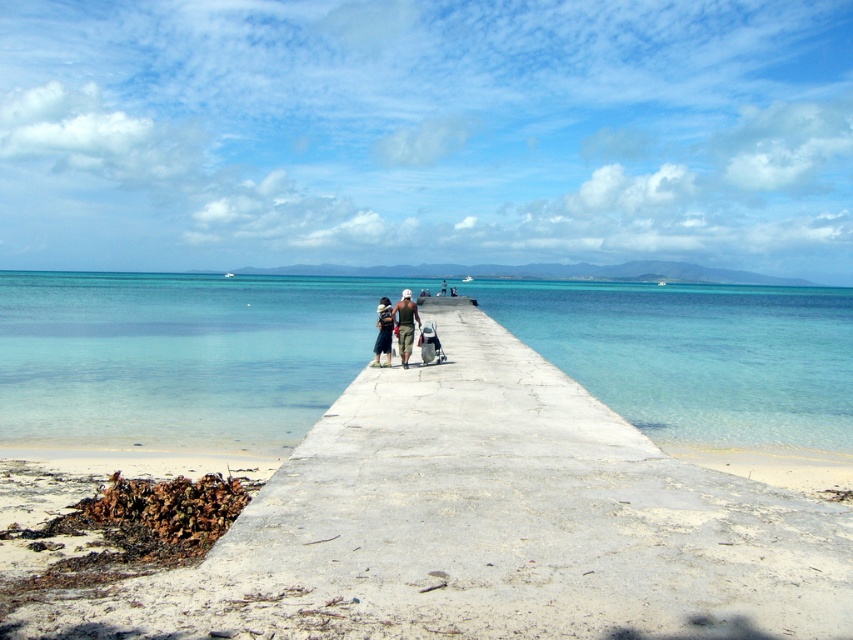
Is clear blue water at center bigger than matte khaki shorts at center?

Indeed, clear blue water at center has a larger size compared to matte khaki shorts at center.

Which of these two, clear blue water at center or matte khaki shorts at center, stands shorter?

matte khaki shorts at center is shorter.

Who is more distant from viewer, (x=212, y=364) or (x=405, y=323)?

Positioned behind is point (x=212, y=364).

You are a GUI agent. You are given a task and a screenshot of the screen. Output one action in this format:
    pyautogui.click(x=<x>, y=<y>)
    Task: Click on the clear blue water at center
    
    Given the screenshot: What is the action you would take?
    pyautogui.click(x=177, y=355)

In the scene shown: Is clear blue water at center smaller than dark green fabric bag at center?

No.

Can you confirm if clear blue water at center is positioned to the left of dark green fabric bag at center?

Correct, you'll find clear blue water at center to the left of dark green fabric bag at center.

Who is more distant from viewer, (672, 314) or (386, 326)?

The point (672, 314) is more distant.

Image resolution: width=853 pixels, height=640 pixels. I want to click on clear blue water at center, so click(x=177, y=355).

Does matte khaki shorts at center have a smaller size compared to dark green fabric bag at center?

Actually, matte khaki shorts at center might be larger than dark green fabric bag at center.

Is point (405, 300) behind point (392, 326)?

Yes, point (405, 300) is behind point (392, 326).

Locate an element on the screen. matte khaki shorts at center is located at coordinates (403, 323).